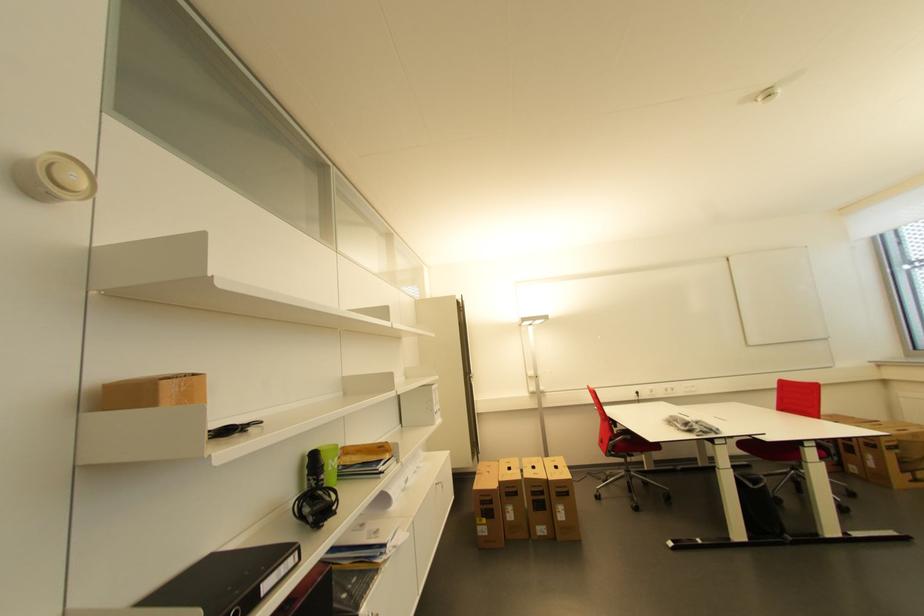
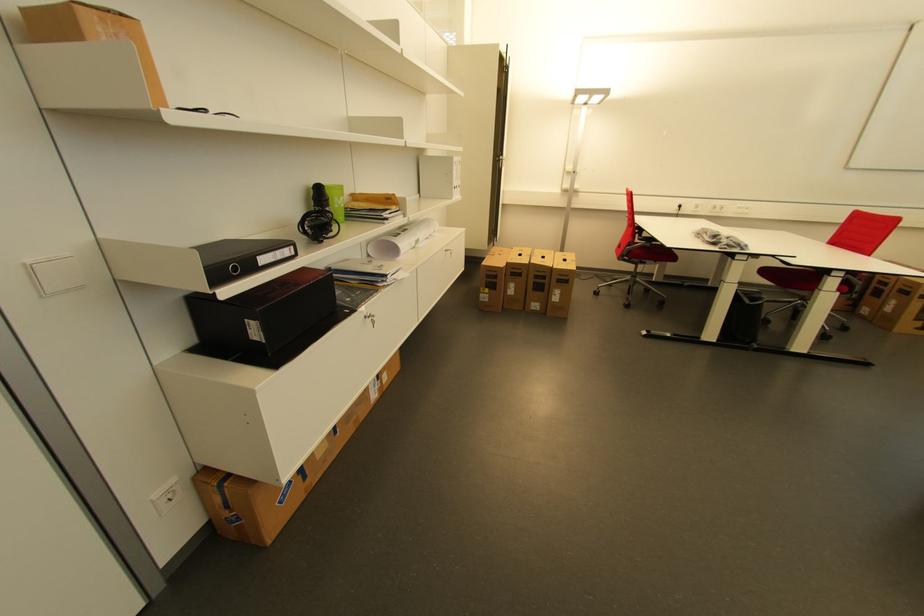
Find the pixel in the second image that matches [496,503] in the first image.

(502, 278)